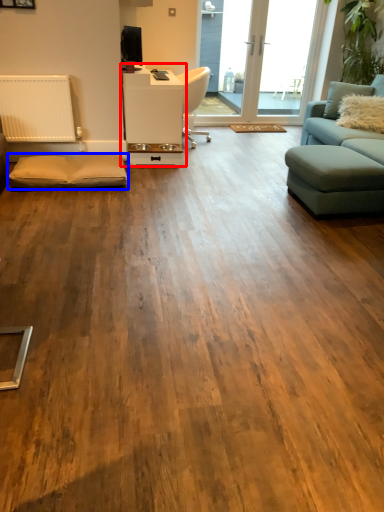
Question: Which of the following is the farthest to the observer, table (highlighted by a red box) or footrest (highlighted by a blue box)?

Choices:
 (A) table
 (B) footrest

Answer: (A)